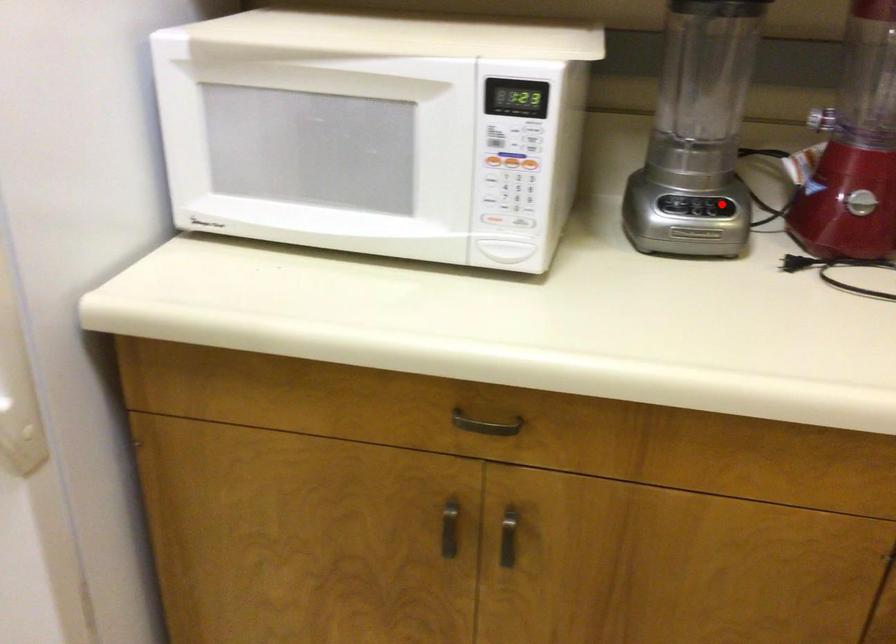
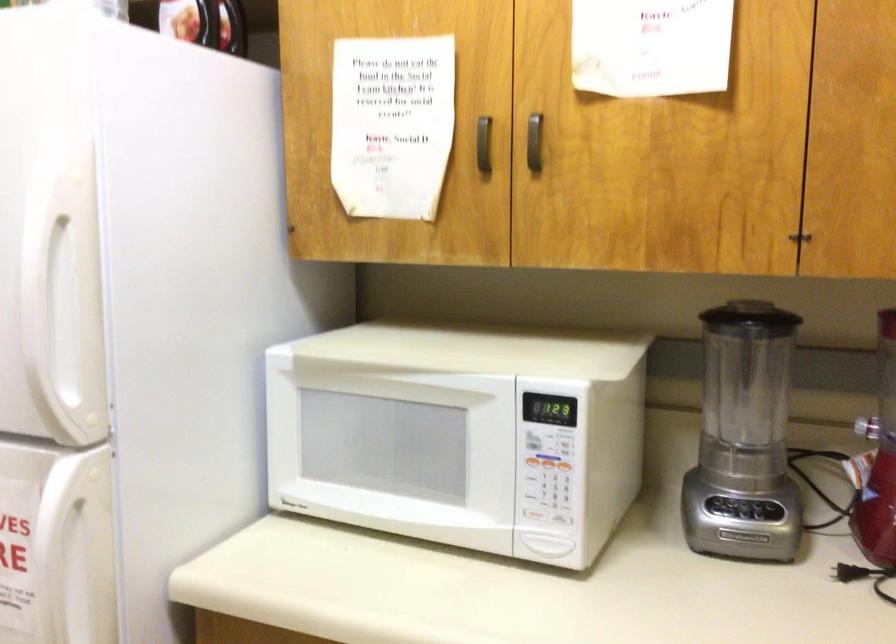
The point at the highlighted location is marked in the first image. Where is the corresponding point in the second image?

(771, 509)